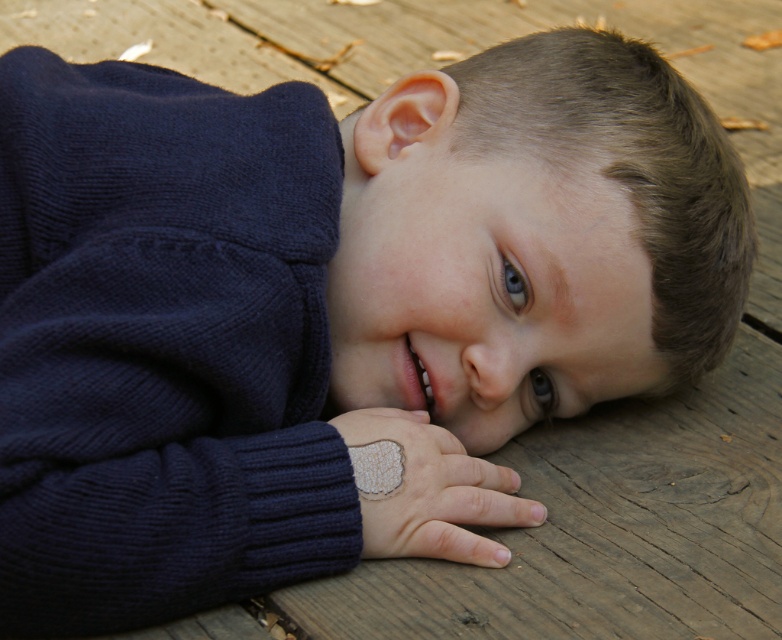
You are a photographer adjusting your camera focus. You need to focus on both the point at point (20, 532) and point (490, 492). Which point should you focus on first to ensure both are in focus?

You should focus on point (20, 532) first because it is closer to the camera than point (490, 492). By focusing on the closer point, the farther point will also be in focus due to the depth of field.

Looking at this image, you are an interior designer assessing the layout of this outdoor space. You notice the navy blue knitted sweater at left and the white textured fabric at center. Which object is positioned higher in the scene?

The navy blue knitted sweater at left is taller than the white textured fabric at center, so it is positioned higher in the scene.

You are a photographer setting up a shoot in an outdoor autumn scene with a wooden surface. You notice the navy blue knitted sweater at left and the white textured fabric at center. Which object is positioned higher in the frame?

The navy blue knitted sweater at left is located above the white textured fabric at center, so it is positioned higher in the frame.